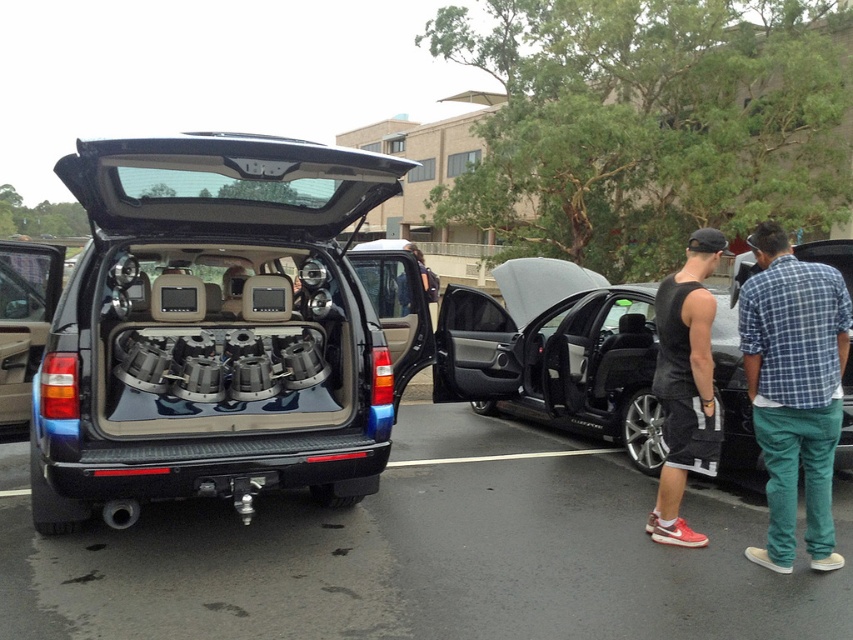
Question: Which point is farther from the camera taking this photo?

Choices:
 (A) (772, 362)
 (B) (569, 413)

Answer: (B)

Question: Can you confirm if black plastic car at center is positioned to the right of black sleeveless tank top at center?

Choices:
 (A) yes
 (B) no

Answer: (B)

Question: Where is black plastic car at center located in relation to black sleeveless tank top at center in the image?

Choices:
 (A) below
 (B) above

Answer: (A)

Question: Is blue plaid shirt at right wider than black sleeveless tank top at center?

Choices:
 (A) yes
 (B) no

Answer: (A)

Question: Among these points, which one is nearest to the camera?

Choices:
 (A) (218, 426)
 (B) (819, 577)
 (C) (552, 346)

Answer: (B)

Question: Which object appears farthest from the camera in this image?

Choices:
 (A) black plastic car at center
 (B) blue plaid shirt at right
 (C) black metallic car at center

Answer: (C)